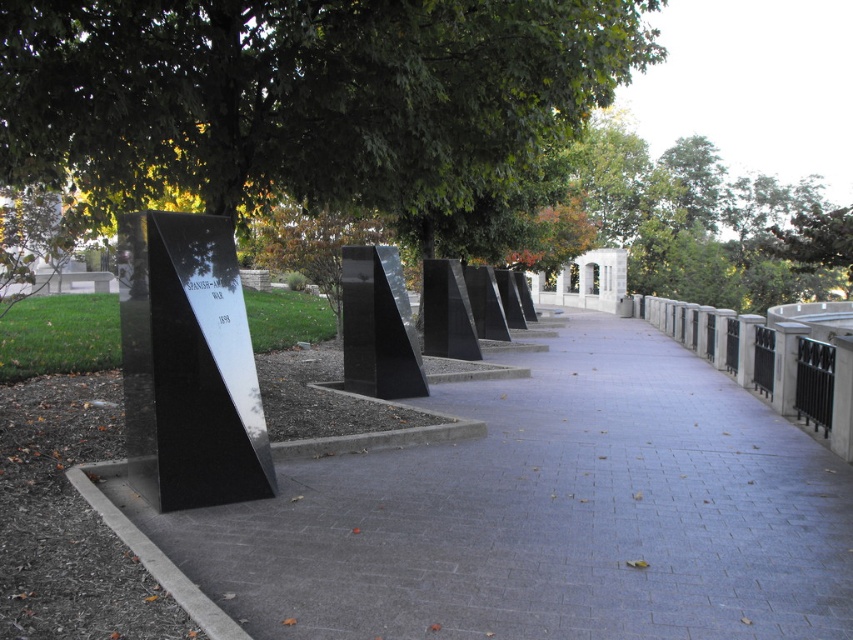
Which is in front, point (662, 595) or point (67, 28)?

Point (662, 595) is more forward.

This screenshot has width=853, height=640. Describe the element at coordinates (532, 516) in the screenshot. I see `gray concrete pavement at center` at that location.

Does point (631, 358) come closer to viewer compared to point (521, 115)?

No, (631, 358) is behind (521, 115).

You are a GUI agent. You are given a task and a screenshot of the screen. Output one action in this format:
    pyautogui.click(x=<x>, y=<y>)
    Task: Click on the gray concrete pavement at center
    The height and width of the screenshot is (640, 853).
    Given the screenshot: What is the action you would take?
    pyautogui.click(x=532, y=516)

How far apart are gray concrete pavement at center and black polished stone monument at center?

They are 7.21 feet apart.

Who is higher up, gray concrete pavement at center or black polished stone monument at center?

black polished stone monument at center

Does point (582, 435) lie behind point (363, 369)?

No.

At what (x,y) coordinates should I click in order to perform the action: click on gray concrete pavement at center. Please return your answer as a coordinate pair (x, y). Looking at the image, I should click on (532, 516).

Does green leafy tree at upper center have a lesser height compared to black polished stone monument at center?

No.

The height and width of the screenshot is (640, 853). What do you see at coordinates (303, 96) in the screenshot?
I see `green leafy tree at upper center` at bounding box center [303, 96].

What are the coordinates of `green leafy tree at upper center` in the screenshot? It's located at (303, 96).

You are a GUI agent. You are given a task and a screenshot of the screen. Output one action in this format:
    pyautogui.click(x=<x>, y=<y>)
    Task: Click on the green leafy tree at upper center
    The image size is (853, 640).
    Given the screenshot: What is the action you would take?
    pyautogui.click(x=303, y=96)